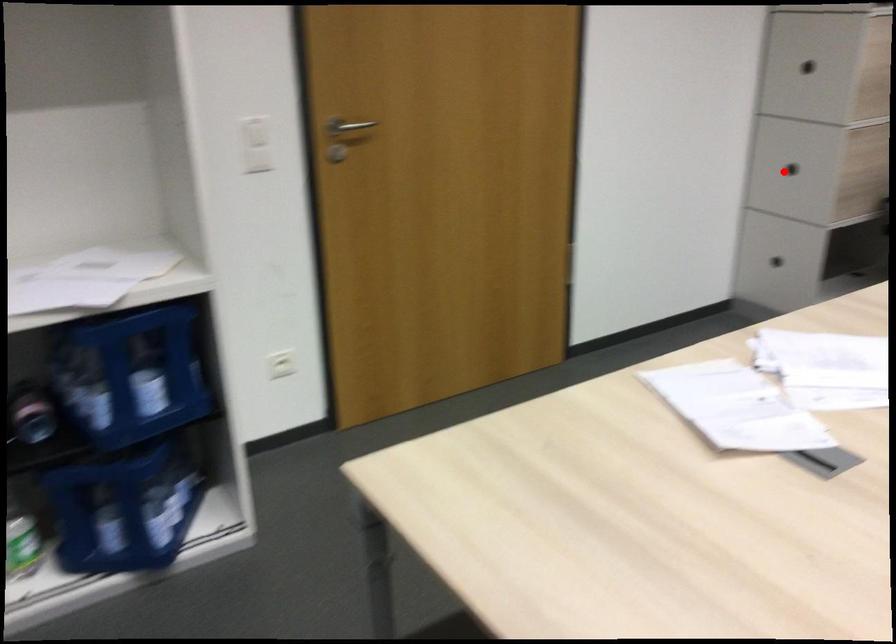
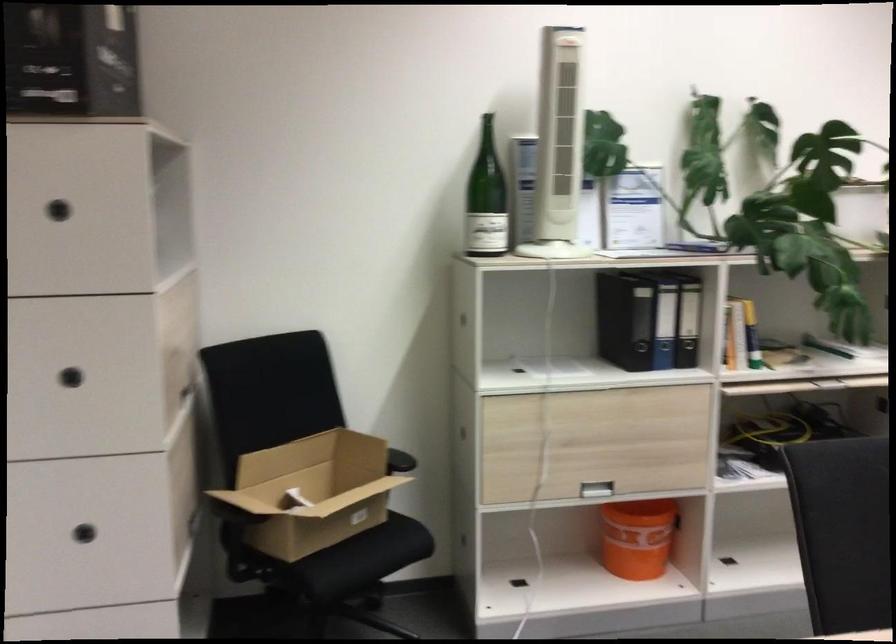
In the second image, find the point that corresponds to the highlighted location in the first image.

(83, 534)